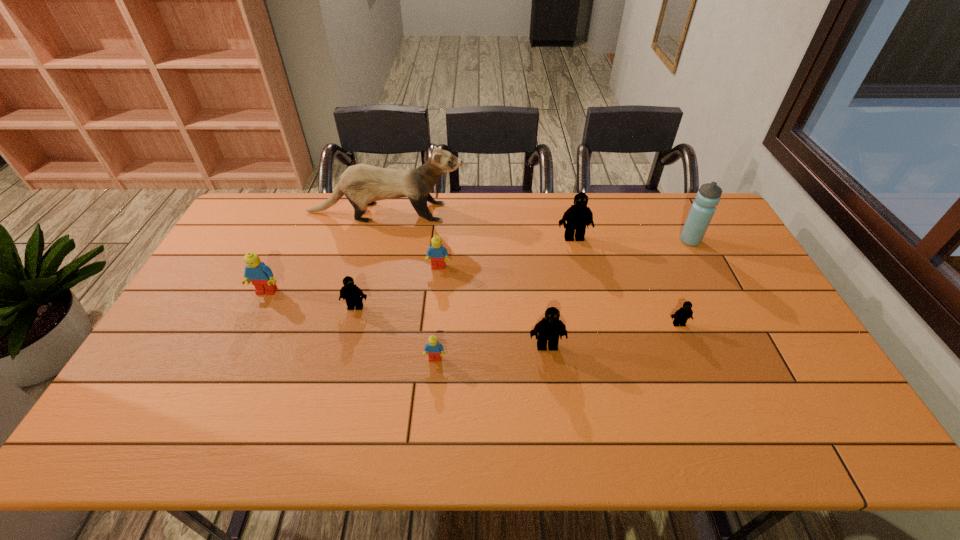
Image resolution: width=960 pixels, height=540 pixels. In order to click on vacant area between the fourth farthest object and the nearest blue Lego in this screenshot , I will do `click(437, 313)`.

At what (x,y) coordinates should I click in order to perform the action: click on free spot between the gray ferret and the water bottle. Please return your answer as a coordinate pair (x, y). Image resolution: width=960 pixels, height=540 pixels. Looking at the image, I should click on (538, 226).

The image size is (960, 540). What are the coordinates of `object that is the fourth nearest to the second biggest black Lego` in the screenshot? It's located at (577, 216).

At what (x,y) coordinates should I click in order to perform the action: click on the third closest object relative to the seventh farthest object. Please return your answer as a coordinate pair (x, y). This screenshot has height=540, width=960. Looking at the image, I should click on (577, 216).

This screenshot has height=540, width=960. Identify the location of Lego identified as the closest to the biggest black Lego. (437, 252).

Point out which Lego is positioned as the nearest to the third biggest black Lego. Please provide its 2D coordinates. Your answer should be formatted as a tuple, i.e. [(x, y)], where the tuple contains the x and y coordinates of a point satisfying the conditions above.

[(261, 276)]

Select which black Lego appears as the closest to the water bottle. Please provide its 2D coordinates. Your answer should be formatted as a tuple, i.e. [(x, y)], where the tuple contains the x and y coordinates of a point satisfying the conditions above.

[(577, 216)]

Where is `black Lego that is the second closest to the leftmost Lego`? This screenshot has width=960, height=540. black Lego that is the second closest to the leftmost Lego is located at coordinates [x=549, y=328].

Locate which blue Lego ranks second in proximity to the third smallest black Lego. Please provide its 2D coordinates. Your answer should be formatted as a tuple, i.e. [(x, y)], where the tuple contains the x and y coordinates of a point satisfying the conditions above.

[(437, 252)]

Identify which blue Lego is the second closest to the leftmost blue Lego. Please provide its 2D coordinates. Your answer should be formatted as a tuple, i.e. [(x, y)], where the tuple contains the x and y coordinates of a point satisfying the conditions above.

[(434, 349)]